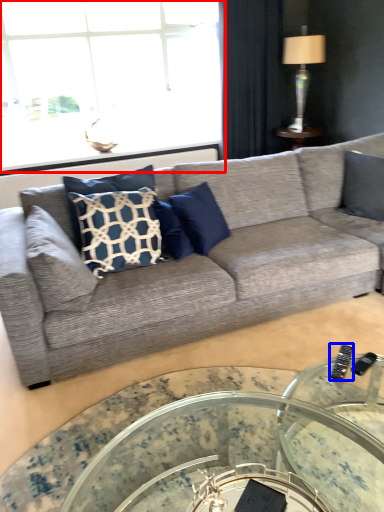
Question: Which object is further to the camera taking this photo, window (highlighted by a red box) or remote (highlighted by a blue box)?

Choices:
 (A) window
 (B) remote

Answer: (A)